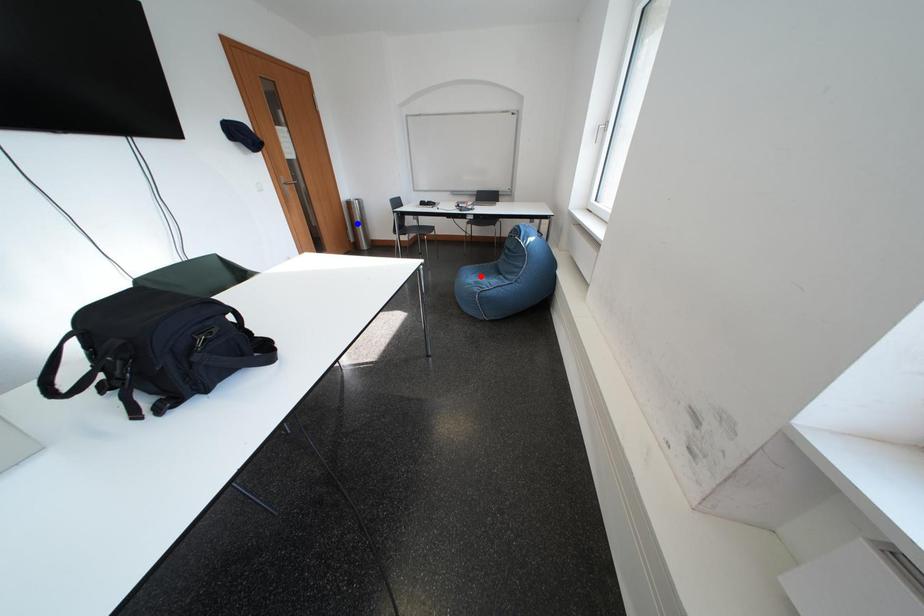
Question: Which of the two points in the image is closer to the camera?

Choices:
 (A) Blue point is closer.
 (B) Red point is closer.

Answer: (B)